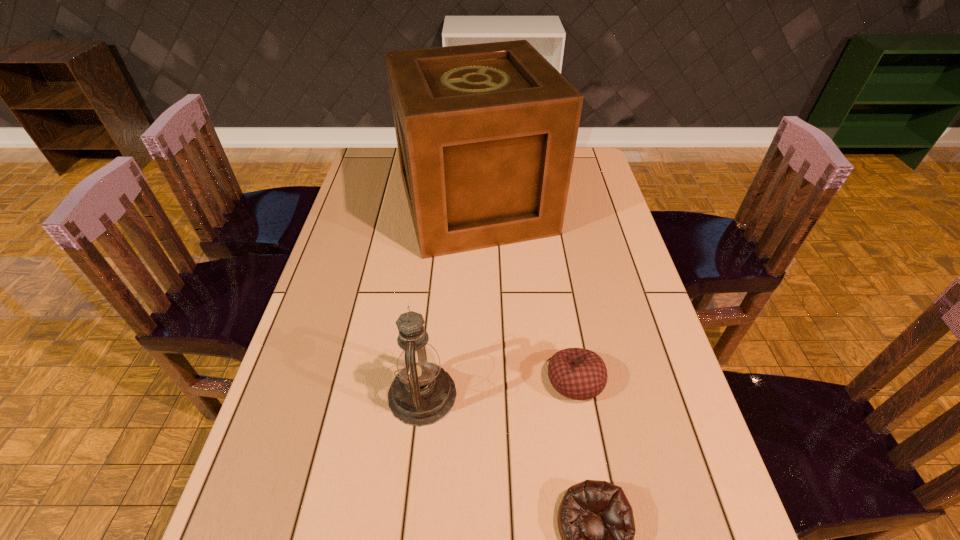
You are a GUI agent. You are given a task and a screenshot of the screen. Output one action in this format:
    pyautogui.click(x=<x>, y=<y>)
    Task: Click on the farthest object
    Image resolution: width=960 pixels, height=540 pixels.
    Given the screenshot: What is the action you would take?
    pyautogui.click(x=486, y=133)

This screenshot has height=540, width=960. Find the location of `box`. box is located at coordinates (486, 133).

Locate an element on the screen. The image size is (960, 540). the third shortest object is located at coordinates (422, 393).

This screenshot has height=540, width=960. In order to click on the farther beanbag in this screenshot , I will do `click(580, 374)`.

The width and height of the screenshot is (960, 540). Find the location of `the taller beanbag`. the taller beanbag is located at coordinates (580, 374).

What are the coordinates of `free location located on the front of the tallest object` in the screenshot? It's located at (474, 322).

This screenshot has width=960, height=540. I want to click on vacant space located 0.340m on the back of the oil lamp, so click(436, 266).

Find the location of `free space located on the back of the farther beanbag`. free space located on the back of the farther beanbag is located at coordinates (561, 295).

Locate an element on the screen. The height and width of the screenshot is (540, 960). object that is at the far edge is located at coordinates (486, 133).

At what (x,y) coordinates should I click in order to perform the action: click on vacant space at the left edge of the desktop. Please return your answer as a coordinate pair (x, y). Looking at the image, I should click on (277, 509).